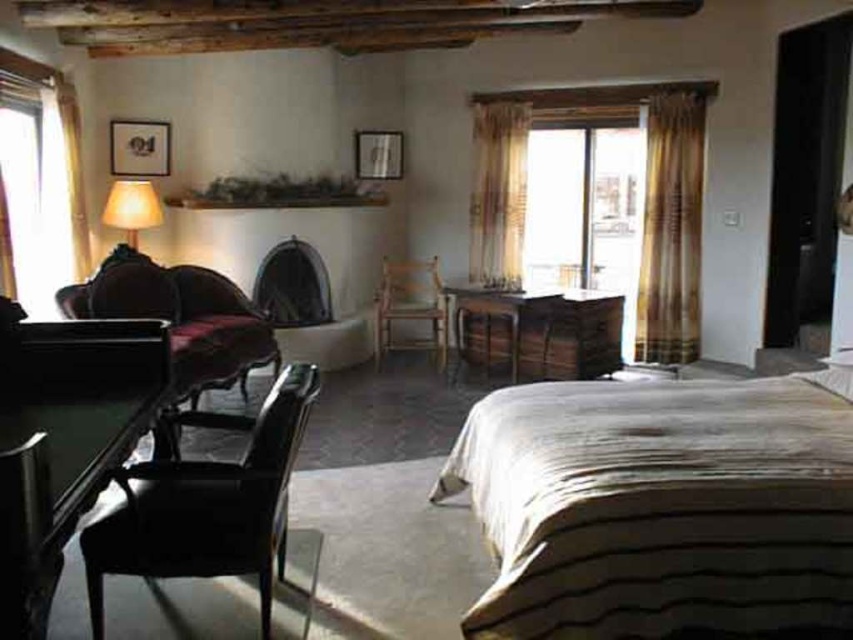
Question: Which point is farther to the camera?

Choices:
 (A) (393, 304)
 (B) (697, 332)

Answer: (A)

Question: Is transparent glass window at left bigger than plaid fabric curtain at right?

Choices:
 (A) no
 (B) yes

Answer: (A)

Question: Is beige textured bed at center thinner than plaid fabric curtain at right?

Choices:
 (A) yes
 (B) no

Answer: (B)

Question: Among these points, which one is nearest to the camera?

Choices:
 (A) (508, 332)
 (B) (476, 406)
 (C) (99, 577)
 (D) (13, 630)

Answer: (D)

Question: Considering the real-world distances, which object is farthest from the shiny dark wood table at lower left?

Choices:
 (A) matte black armchair at lower left
 (B) wooden armchair at center
 (C) plaid fabric curtain at right

Answer: (C)

Question: Is matte black armchair at lower left to the right of matte fabric lampshade at left from the viewer's perspective?

Choices:
 (A) no
 (B) yes

Answer: (B)